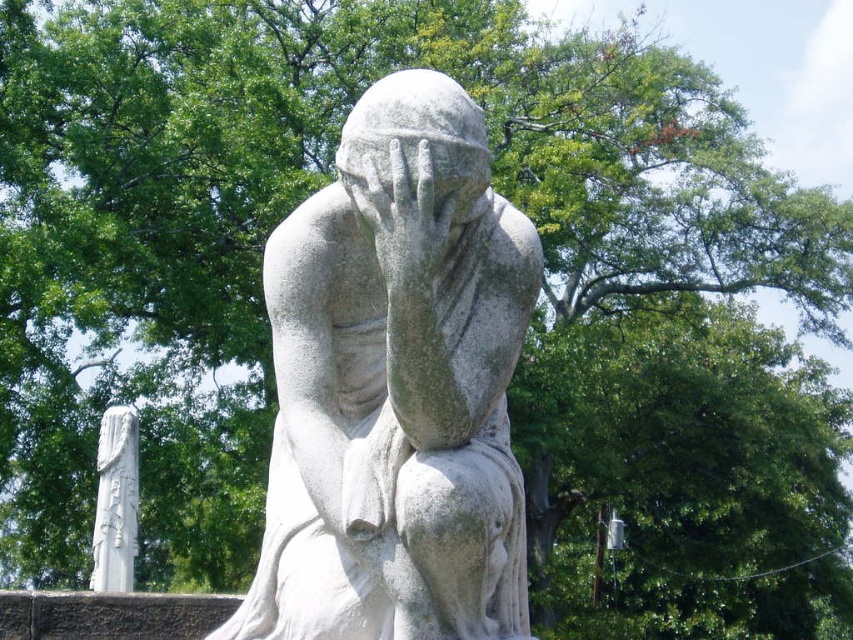
You are an art conservator examining the sculpture. You need to move a protective cover from the white stone column at left to the smooth stone hand at center. Which direction should you move the cover towards?

The smooth stone hand at center is to the right of the white stone column at left, so you should move the protective cover towards the right direction.

You are an art conservator assessing the stone sculpture and column in the image. Given that the white stone statue at center is larger than the white stone column at left, which object would require more material for restoration if both are damaged equally?

The white stone statue at center would require more material for restoration since it is larger in size than the white stone column at left.